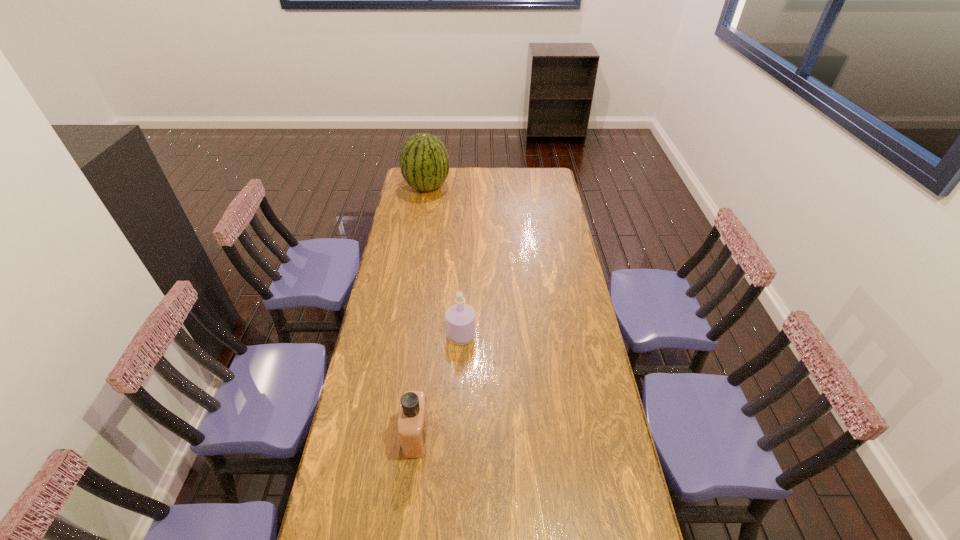
The height and width of the screenshot is (540, 960). Identify the location of watermelon. (424, 162).

Find the location of a particular element. the farthest object is located at coordinates (424, 162).

This screenshot has width=960, height=540. Find the location of `the right perfume`. the right perfume is located at coordinates (460, 318).

I want to click on the rightmost object, so click(460, 318).

At what (x,y) coordinates should I click in order to perform the action: click on the nearest object. Please return your answer as a coordinate pair (x, y). Image resolution: width=960 pixels, height=540 pixels. Looking at the image, I should click on (413, 423).

At what (x,y) coordinates should I click in order to perform the action: click on the left perfume. Please return your answer as a coordinate pair (x, y). Looking at the image, I should click on (413, 423).

Find the location of a particular element. The width and height of the screenshot is (960, 540). vacant space located on the front of the tallest object is located at coordinates (422, 213).

The height and width of the screenshot is (540, 960). I want to click on free point located on the front of the farther perfume, so click(x=458, y=428).

Locate an element on the screen. This screenshot has height=540, width=960. blank area located 0.310m on the front label of the nearer perfume is located at coordinates (x=523, y=435).

Identify the location of object that is at the far edge. This screenshot has width=960, height=540. (424, 162).